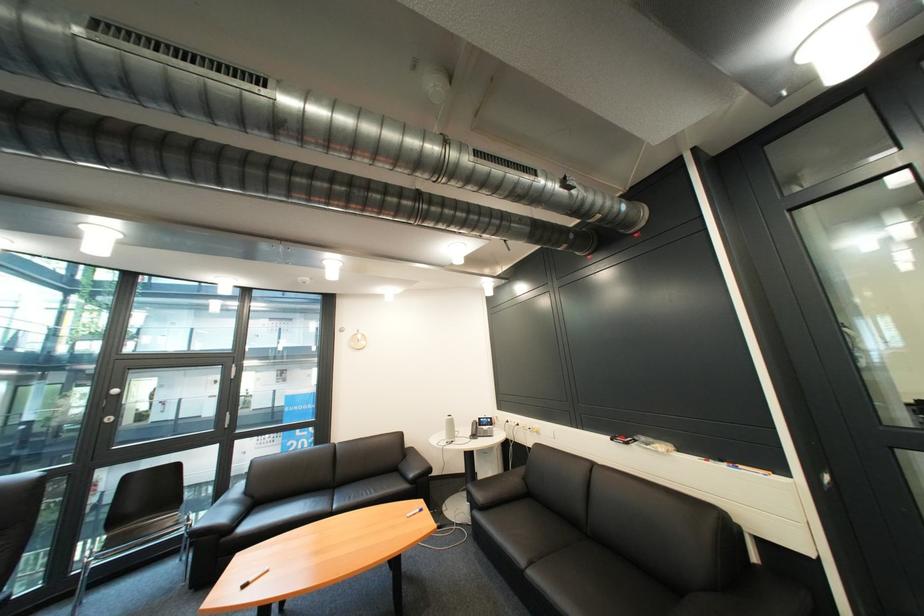
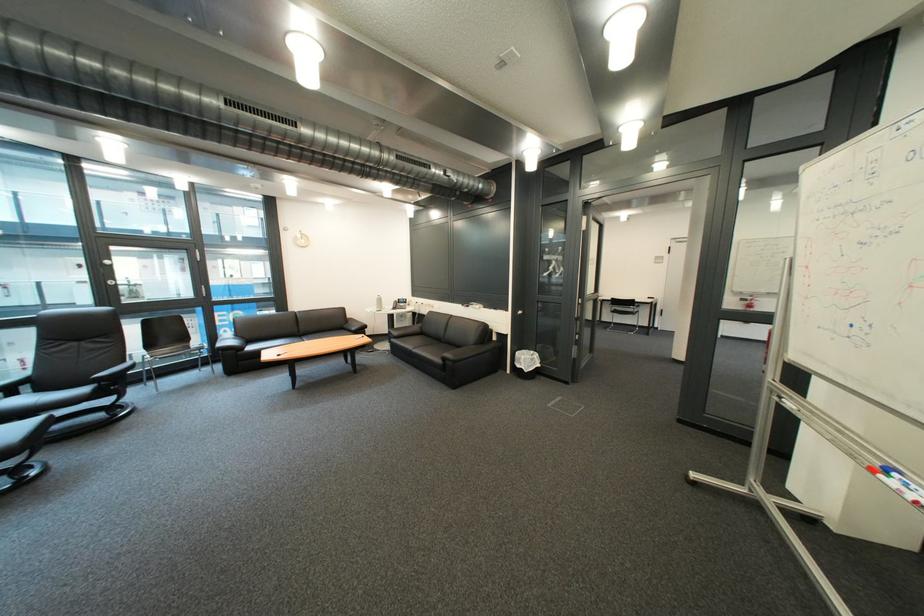
Locate, in the second image, the point that corresponds to (546,577) in the first image.

(429, 353)